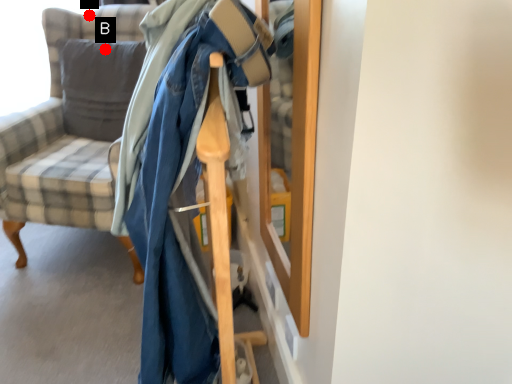
Question: Two points are circled on the image, labeled by A and B beside each circle. Which point is farther from the camera taking this photo?

Choices:
 (A) A is further
 (B) B is further

Answer: (A)